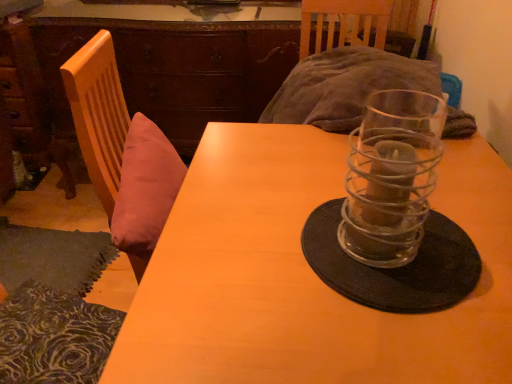
Locate an element on the screen. This screenshot has width=512, height=384. free point behind black matte glass plate at center is located at coordinates (342, 168).